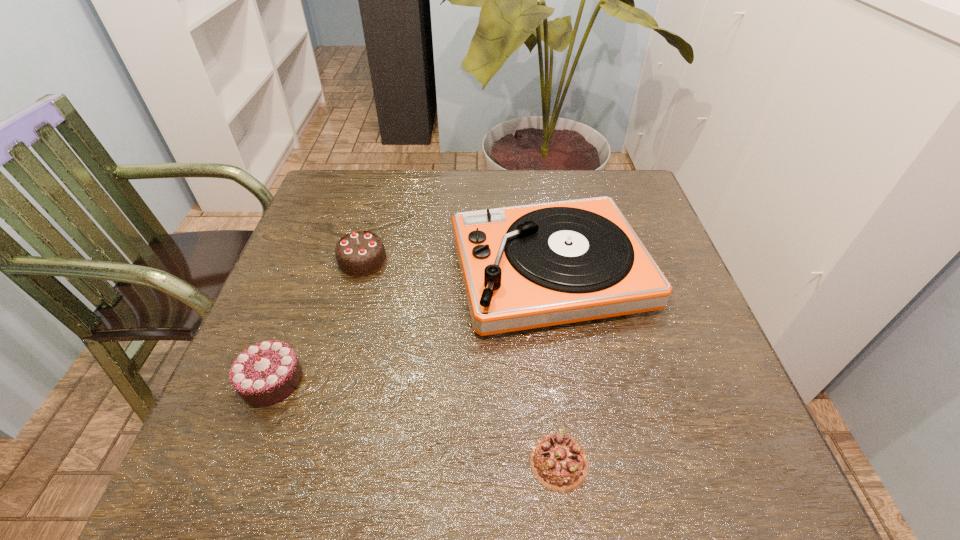
The height and width of the screenshot is (540, 960). What are the coordinates of `object positioned at the far edge` in the screenshot? It's located at (523, 267).

Find the location of `object that is at the near edge`. object that is at the near edge is located at coordinates (559, 462).

Where is `object that is at the right edge`? Image resolution: width=960 pixels, height=540 pixels. object that is at the right edge is located at coordinates (523, 267).

Locate an element on the screen. object present at the far right corner is located at coordinates (523, 267).

Identify the location of free point at the far edge. This screenshot has width=960, height=540. (570, 193).

Locate an element on the screen. Image resolution: width=960 pixels, height=540 pixels. vacant space at the near edge of the desktop is located at coordinates (535, 482).

Image resolution: width=960 pixels, height=540 pixels. Identify the location of free space at the left edge of the desktop. pyautogui.click(x=222, y=398).

In the image, there is a desktop. Where is `vacant space at the right edge`? The width and height of the screenshot is (960, 540). vacant space at the right edge is located at coordinates (665, 311).

The height and width of the screenshot is (540, 960). I want to click on free space at the far left corner, so click(344, 178).

Find the location of a particular element. The height and width of the screenshot is (540, 960). free region at the far right corner is located at coordinates (632, 201).